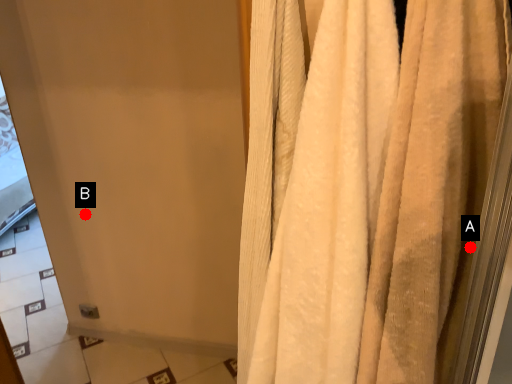
Question: Two points are circled on the image, labeled by A and B beside each circle. Which point is closer to the camera?

Choices:
 (A) A is closer
 (B) B is closer

Answer: (A)